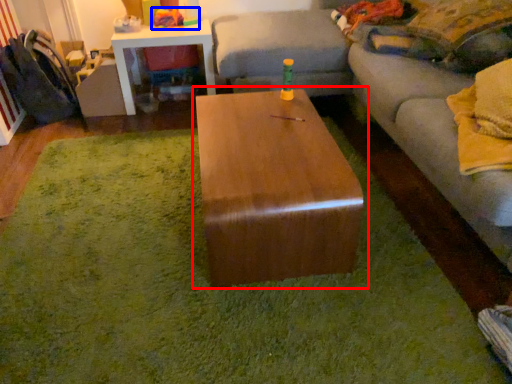
Question: Which object appears closest to the camera in this image, coffee table (highlighted by a red box) or toy (highlighted by a blue box)?

Choices:
 (A) coffee table
 (B) toy

Answer: (A)